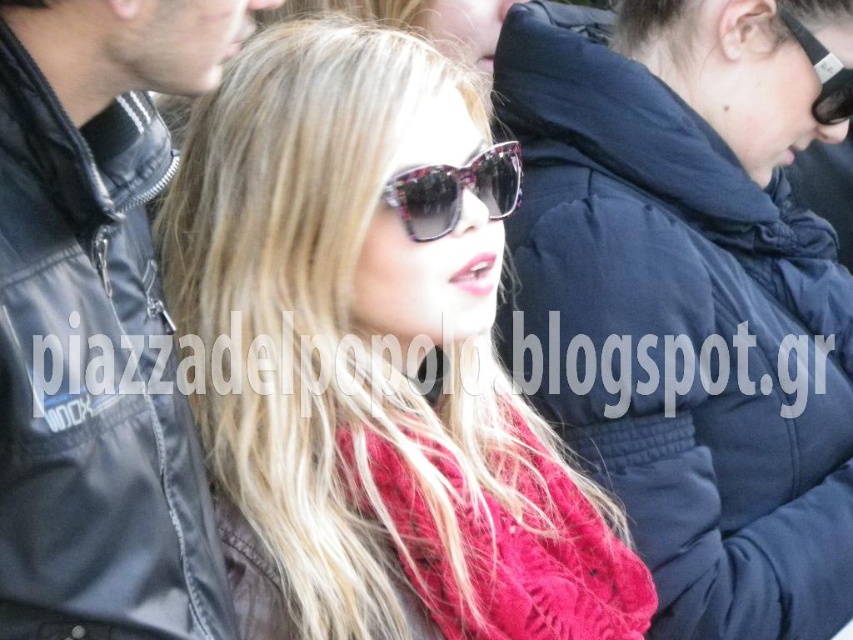
Which of these two, dark blue puffer jacket at upper right or shiny floral-patterned sunglasses at center, stands shorter?

shiny floral-patterned sunglasses at center

Measure the distance between point (824, 288) and camera.

Point (824, 288) and camera are 2.21 meters apart from each other.

Locate an element on the screen. The image size is (853, 640). dark blue puffer jacket at upper right is located at coordinates (685, 301).

Who is positioned more to the right, shiny floral-patterned sunglasses at center or black plastic sunglasses at upper right?

black plastic sunglasses at upper right

Between point (502, 186) and point (813, 54), which one is positioned behind?

Positioned behind is point (813, 54).

Where is `shiny floral-patterned sunglasses at center`? This screenshot has height=640, width=853. shiny floral-patterned sunglasses at center is located at coordinates (456, 189).

Is black leather jacket at left below shiny floral-patterned sunglasses at center?

Yes.

Who is more forward, (117, 589) or (500, 172)?

Point (117, 589) is in front.

Identify the location of black leather jacket at left. The height and width of the screenshot is (640, 853). (96, 323).